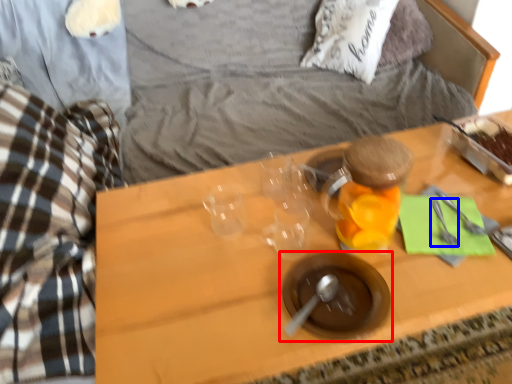
Question: Which of the following is the farthest to the observer, tableware (highlighted by a red box) or silverware (highlighted by a blue box)?

Choices:
 (A) tableware
 (B) silverware

Answer: (B)